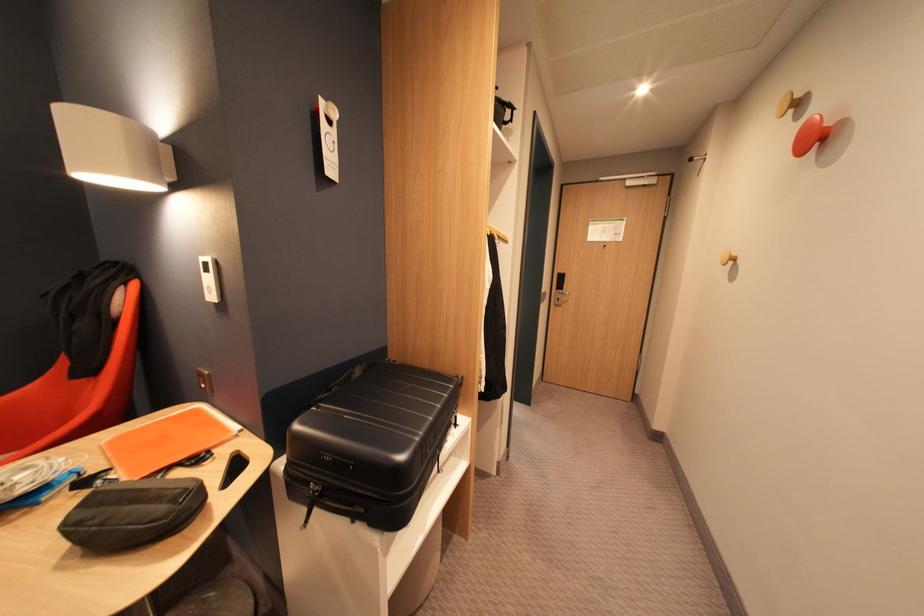
Find where to push the silver door handle. Please return your answer as a coordinate pair (x, y).

(560, 297)